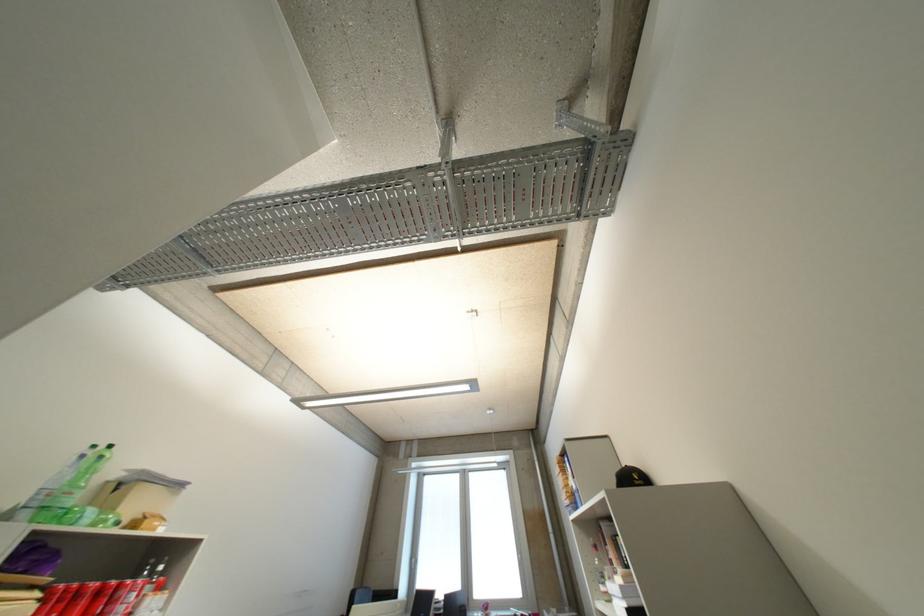
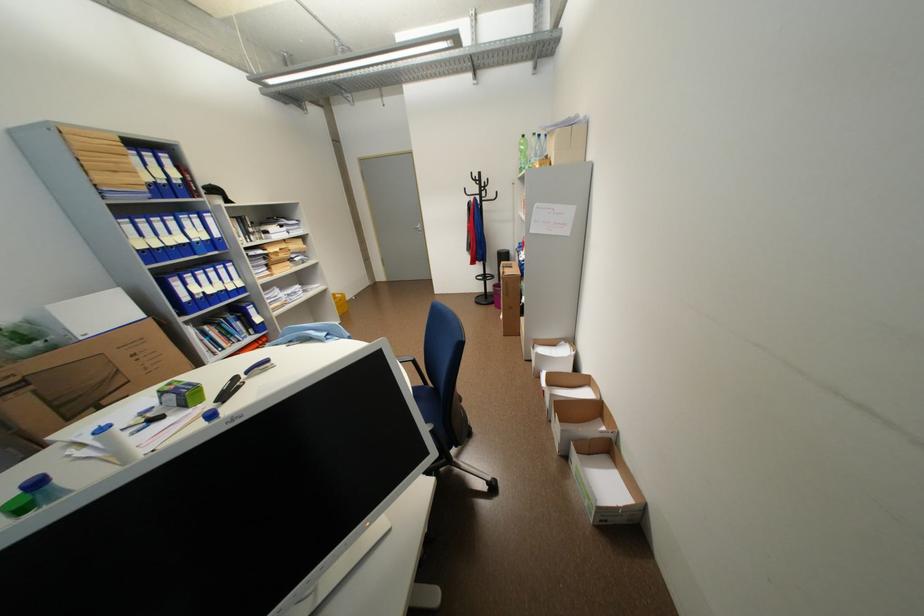
In the second image, find the point that corresponds to point 118,447 in the first image.

(531, 137)